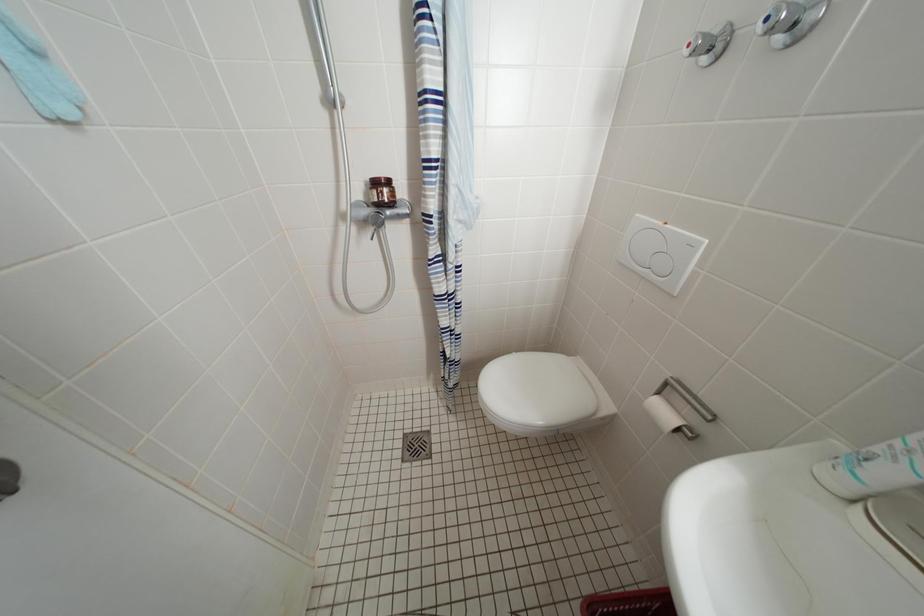
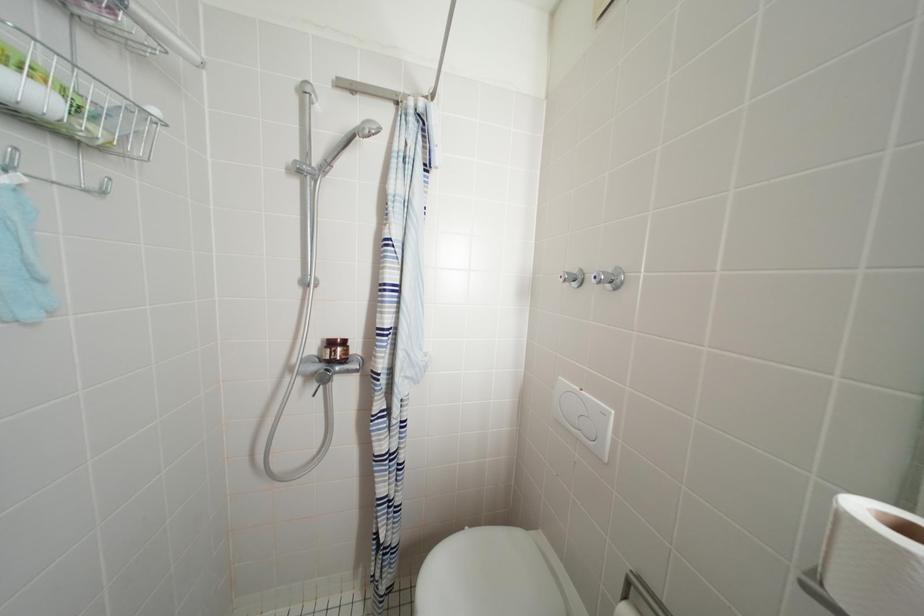
In a continuous first-person perspective shot, in which direction is the camera moving?

The cameraman walked toward right, backward.